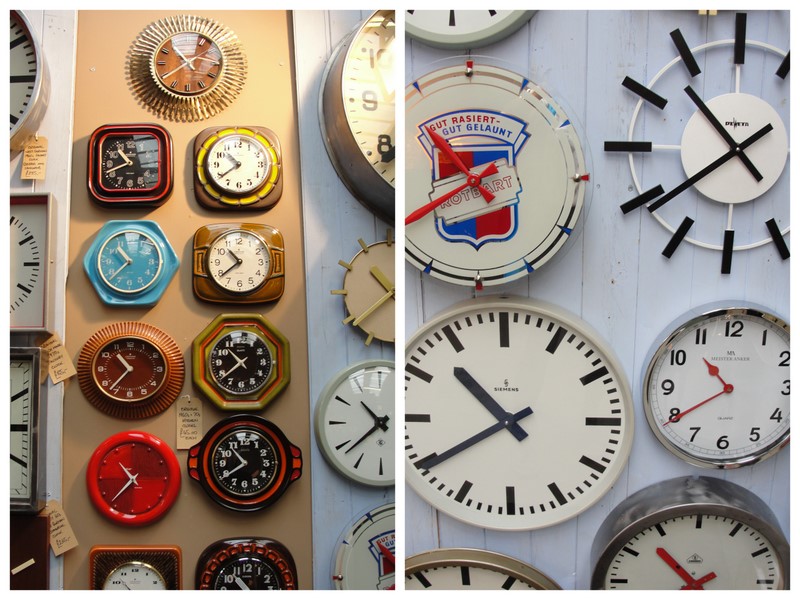
The width and height of the screenshot is (800, 600). In order to click on wall in this screenshot , I will do `click(590, 59)`, `click(314, 40)`, `click(262, 67)`, `click(70, 78)`.